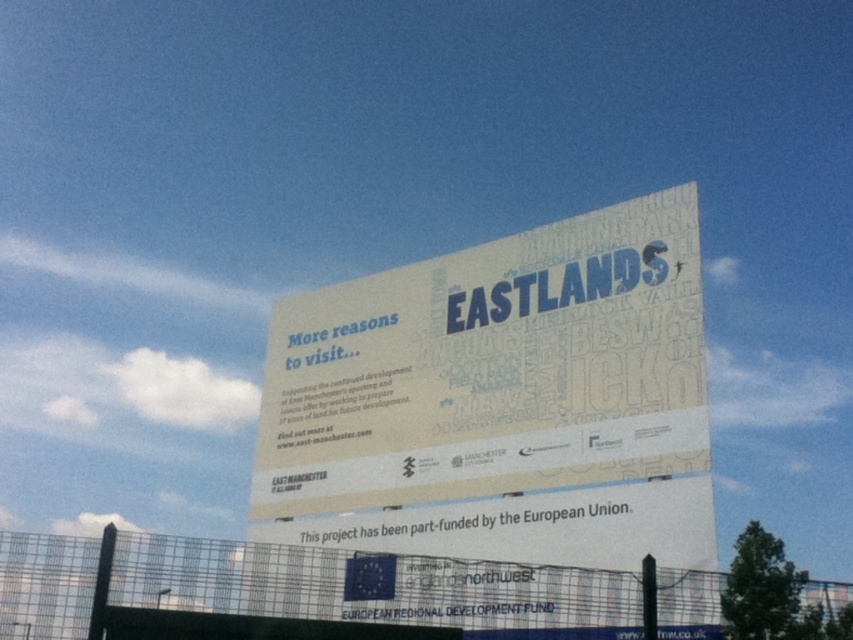
Question: Among these points, which one is farthest from the camera?

Choices:
 (A) (572, 582)
 (B) (262, 516)

Answer: (B)

Question: Does white paper billboard at center have a greater width compared to metal mesh fence at lower center?

Choices:
 (A) no
 (B) yes

Answer: (A)

Question: Does white paper billboard at center appear over metal mesh fence at lower center?

Choices:
 (A) yes
 (B) no

Answer: (A)

Question: Can you confirm if white paper billboard at center is thinner than metal mesh fence at lower center?

Choices:
 (A) no
 (B) yes

Answer: (B)